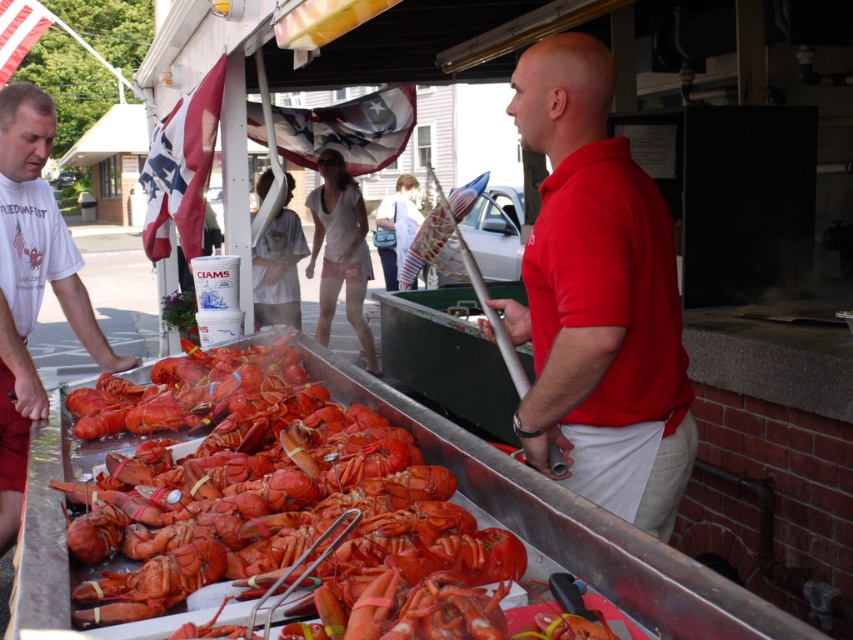
Question: Which point is farther to the camera?

Choices:
 (A) (154, 522)
 (B) (566, 333)

Answer: (B)

Question: Is shiny red lobster at center to the right of red cotton shirt at center from the viewer's perspective?

Choices:
 (A) yes
 (B) no

Answer: (B)

Question: Does shiny red lobster at center appear on the right side of white t-shirt at left?

Choices:
 (A) yes
 (B) no

Answer: (A)

Question: Which object is closer to the camera taking this photo?

Choices:
 (A) shiny red lobster at center
 (B) white t-shirt at left

Answer: (A)

Question: Considering the relative positions of red cotton shirt at center and white t-shirt at left in the image provided, where is red cotton shirt at center located with respect to white t-shirt at left?

Choices:
 (A) above
 (B) below

Answer: (A)

Question: Which object appears farthest from the camera in this image?

Choices:
 (A) red cotton shirt at center
 (B) shiny red lobster at center
 (C) white t-shirt at left

Answer: (C)